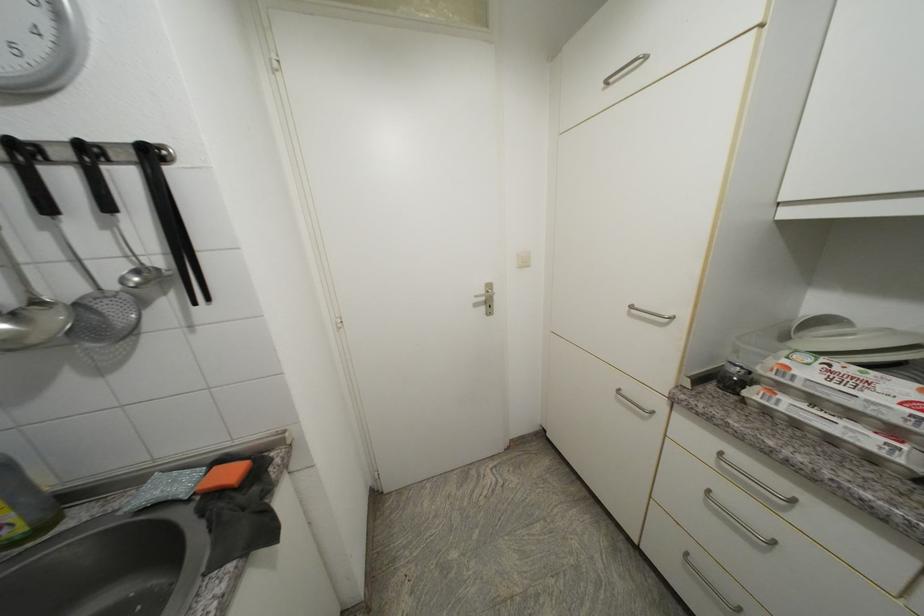
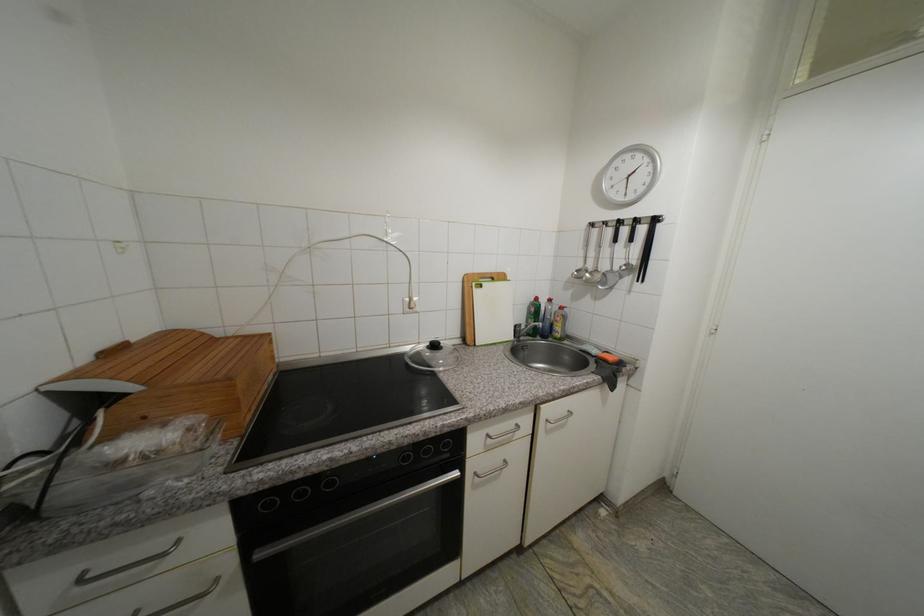
Question: The first image is from the beginning of the video and the second image is from the end. How did the camera likely rotate when shooting the video?

Choices:
 (A) Left
 (B) Right
 (C) Up
 (D) Down

Answer: (A)